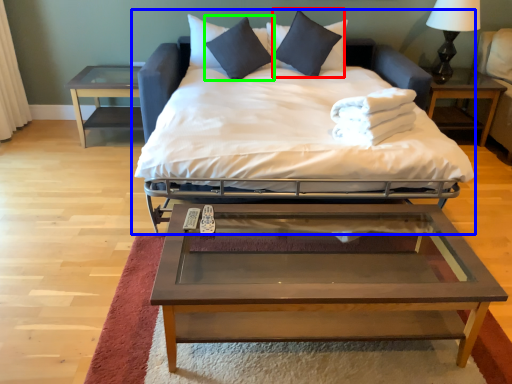
Question: Considering the real-world distances, which object is closest to pillow (highlighted by a red box)? bed (highlighted by a blue box) or pillow (highlighted by a green box).

Choices:
 (A) bed
 (B) pillow

Answer: (B)